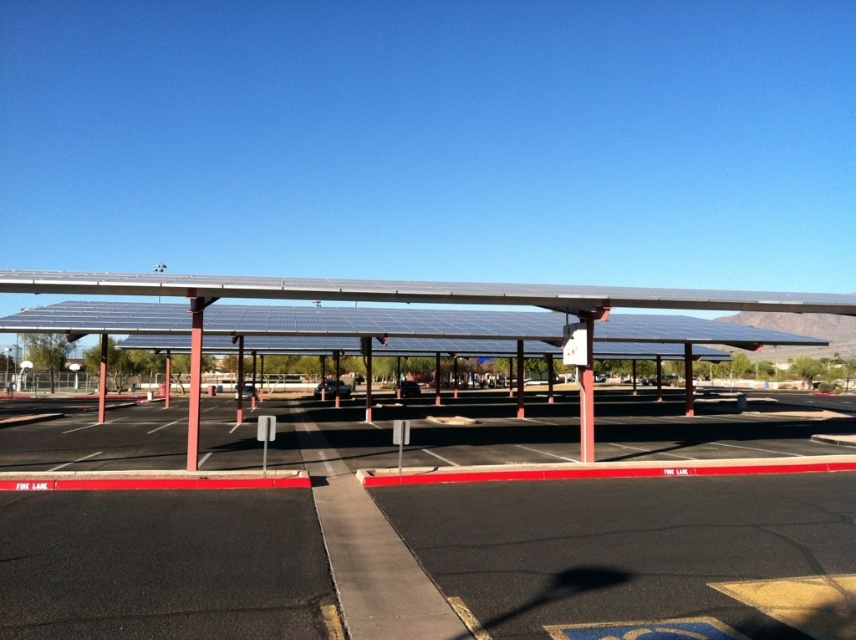
You are standing in the parking lot and want to take a photo of the metallic solar panels at center. If your camera has a maximum zoom range of 10 meters, will you be able to capture a clear closeup without moving closer?

The metallic solar panels at center are 13.07 meters away from you. Since your camera can only zoom up to 10 meters, you will not be able to capture a clear closeup without moving closer.

You are a delivery driver who needs to park your truck in the parking lot. Your truck is 20 feet long. The parking lot has a fire lane marked with red lines. You see the metallic solar panels at center and the metallic pole at center. Is there enough space between them to park your truck?

The distance between the metallic solar panels at center and the metallic pole at center is 22.85 feet, which is longer than your truck length of 20 feet. Therefore, there is sufficient space to park your truck between them.

You are a delivery person trying to park your truck in the parking lot. The truck is 2.5 meters wide. The parking space you want to use is between the metallic solar panels at center and the metallic pole at center. Can your truck fit in that space?

The metallic solar panels at center are wider than the metallic pole at center. The space between them is determined by their widths. Since the truck is 2.5 meters wide and the panels are wider, the space between them may be sufficient. However, without exact measurements, it is uncertain. Check the actual space before parking.